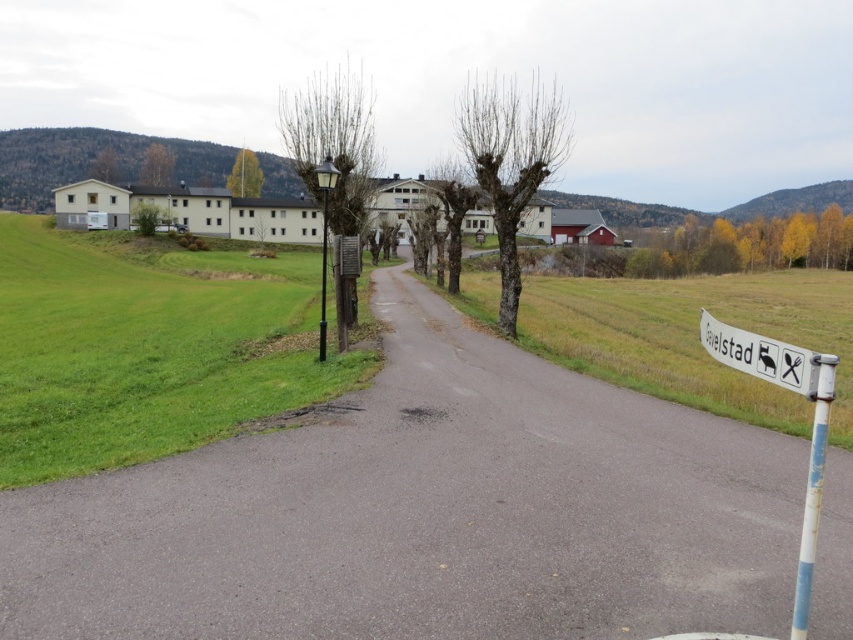
Between asphalt at center and white painted metal pole at right, which one is positioned higher?

Positioned higher is white painted metal pole at right.

Is point (469, 458) positioned behind point (813, 362)?

Yes, it is behind point (813, 362).

The image size is (853, 640). I want to click on asphalt at center, so click(425, 513).

Who is positioned more to the right, asphalt at center or metallic pole at left?

asphalt at center

Locate an element on the screen. Image resolution: width=853 pixels, height=640 pixels. asphalt at center is located at coordinates (425, 513).

Can you confirm if white plastic sign at right is smaller than white painted metal pole at right?

Incorrect, white plastic sign at right is not smaller in size than white painted metal pole at right.

Is white plastic sign at right thinner than white painted metal pole at right?

Incorrect, white plastic sign at right's width is not less than white painted metal pole at right's.

Is point (833, 394) positioned after point (814, 397)?

That is False.

Where is `white plastic sign at right`? This screenshot has width=853, height=640. white plastic sign at right is located at coordinates point(769,358).